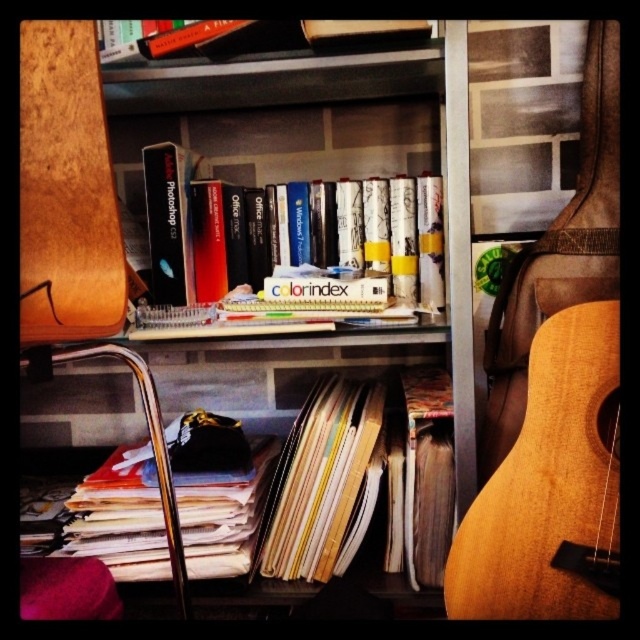
You are organizing the items on the middle shelf of the bookshelf. The natural wood guitar at right and the wooden bookcase at upper center are both on this shelf. Which item takes up more space on the shelf?

The wooden bookcase at upper center occupies more space than the natural wood guitar at right.

Which object is wider, the natural wood guitar at right or the wooden bookcase at upper center?

The natural wood guitar at right is wider than the wooden bookcase at upper center.

What is located at the point with coordinates (550, 486)?

The point with coordinates (550, 486) indicates the location of the natural wood guitar at right.